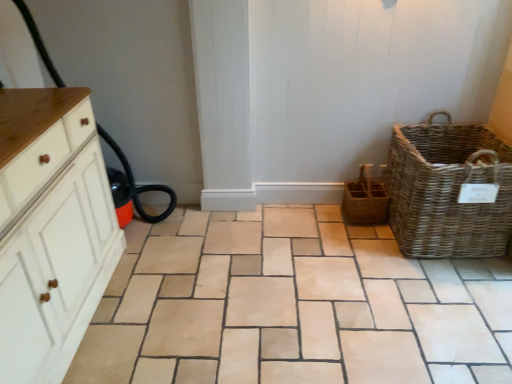
Question: Should I look upward or downward to see natural woven picnic basket at right?

Choices:
 (A) down
 (B) up

Answer: (B)

Question: Is natural stone tile at center at the left side of white wood cabinet at left?

Choices:
 (A) yes
 (B) no

Answer: (B)

Question: Is natural stone tile at center directly adjacent to white wood cabinet at left?

Choices:
 (A) yes
 (B) no

Answer: (B)

Question: Is natural stone tile at center facing towards white wood cabinet at left?

Choices:
 (A) no
 (B) yes

Answer: (B)

Question: Considering the relative sizes of natural stone tile at center and white wood cabinet at left in the image provided, is natural stone tile at center bigger than white wood cabinet at left?

Choices:
 (A) no
 (B) yes

Answer: (A)

Question: Does natural stone tile at center come in front of white wood cabinet at left?

Choices:
 (A) yes
 (B) no

Answer: (B)

Question: Does natural stone tile at center have a greater width compared to white wood cabinet at left?

Choices:
 (A) no
 (B) yes

Answer: (B)

Question: Is natural stone tile at center further to the viewer compared to natural woven picnic basket at right?

Choices:
 (A) no
 (B) yes

Answer: (A)

Question: Is natural stone tile at center positioned beyond the bounds of natural woven picnic basket at right?

Choices:
 (A) yes
 (B) no

Answer: (A)

Question: Is natural woven picnic basket at right inside natural stone tile at center?

Choices:
 (A) yes
 (B) no

Answer: (B)

Question: Is natural stone tile at center at the right side of natural woven picnic basket at right?

Choices:
 (A) yes
 (B) no

Answer: (B)

Question: Is natural stone tile at center in contact with natural woven picnic basket at right?

Choices:
 (A) yes
 (B) no

Answer: (B)

Question: Is natural stone tile at center wider than natural woven picnic basket at right?

Choices:
 (A) yes
 (B) no

Answer: (A)

Question: From a real-world perspective, does white wood cabinet at left stand above natural stone tile at center?

Choices:
 (A) no
 (B) yes

Answer: (B)